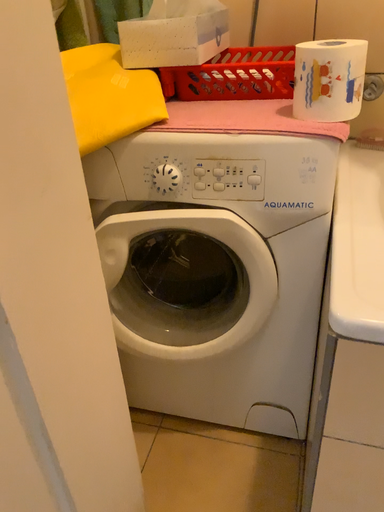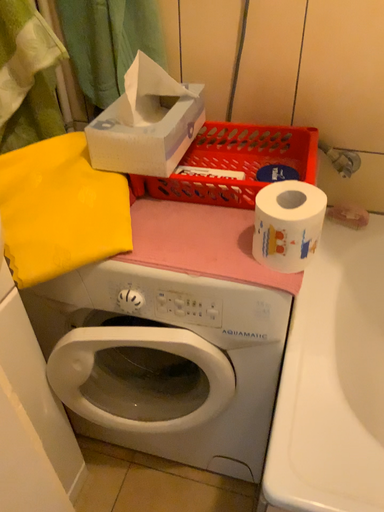
Question: Which way did the camera rotate in the video?

Choices:
 (A) rotated downward
 (B) rotated upward

Answer: (A)